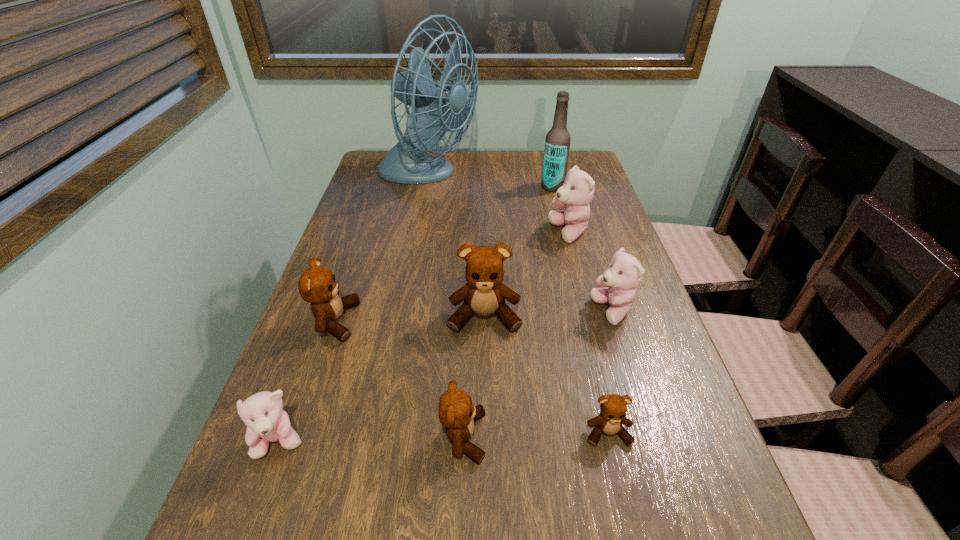
Find the location of a particular element. The height and width of the screenshot is (540, 960). vacant area that lies between the third farthest object and the second biggest pink teddy bear is located at coordinates (590, 272).

Point out which object is positioned as the eighth nearest to the second smallest brown teddy bear. Please provide its 2D coordinates. Your answer should be formatted as a tuple, i.e. [(x, y)], where the tuple contains the x and y coordinates of a point satisfying the conditions above.

[(557, 143)]

You are a GUI agent. You are given a task and a screenshot of the screen. Output one action in this format:
    pyautogui.click(x=<x>, y=<y>)
    Task: Click on the object that stands as the second closest to the second tallest object
    The image size is (960, 540).
    Given the screenshot: What is the action you would take?
    [x=435, y=107]

Locate an element on the screen. Image resolution: width=960 pixels, height=540 pixels. teddy bear that stands as the sixth closest to the biggest brown teddy bear is located at coordinates (266, 421).

Locate an element on the screen. The height and width of the screenshot is (540, 960). teddy bear that is the fourth closest to the tallest object is located at coordinates (624, 273).

Locate an element on the screen. the closest pink teddy bear to the third biggest brown teddy bear is located at coordinates (266, 421).

This screenshot has height=540, width=960. What are the coordinates of `the second closest pink teddy bear to the biggest pink teddy bear` in the screenshot? It's located at (266, 421).

Where is `brown teddy bear that is the closest to the biggest brown teddy bear`? brown teddy bear that is the closest to the biggest brown teddy bear is located at coordinates (456, 412).

Identify which brown teddy bear is the nearest to the leftmost pink teddy bear. Please provide its 2D coordinates. Your answer should be formatted as a tuple, i.e. [(x, y)], where the tuple contains the x and y coordinates of a point satisfying the conditions above.

[(317, 285)]

The width and height of the screenshot is (960, 540). In order to click on free space that satisfies the following two spatial constraints: 1. on the label of the beer bottle; 2. on the front-facing side of the smallest brown teddy bear in this screenshot , I will do `click(613, 433)`.